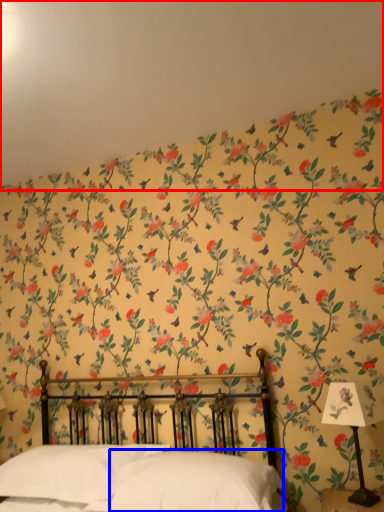
Question: Which point is closer to the camera, backdrop (highlighted by a red box) or pillow (highlighted by a blue box)?

Choices:
 (A) backdrop
 (B) pillow

Answer: (A)